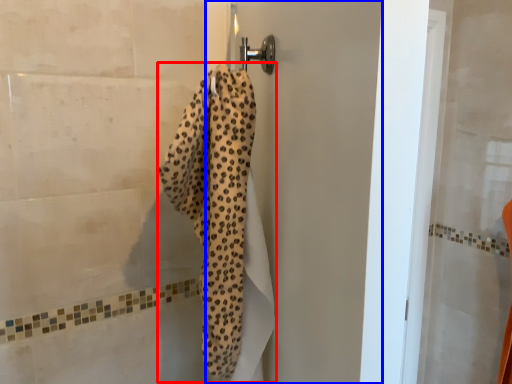
Question: Which point is further to the camera, bath towel (highlighted by a red box) or screen door (highlighted by a blue box)?

Choices:
 (A) bath towel
 (B) screen door

Answer: (B)